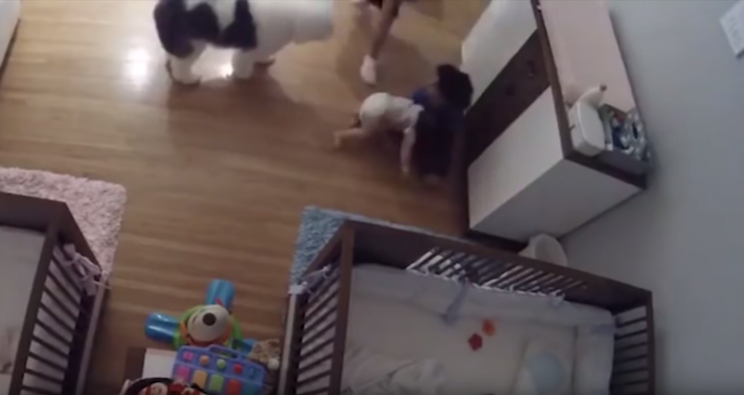
Locate an element on the screen. space above trashcan is located at coordinates (586, 252).